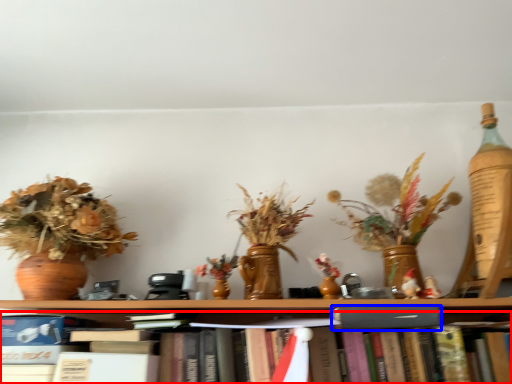
Question: Which object appears closest to the camera in this image, book (highlighted by a red box) or paperback book (highlighted by a blue box)?

Choices:
 (A) book
 (B) paperback book

Answer: (A)